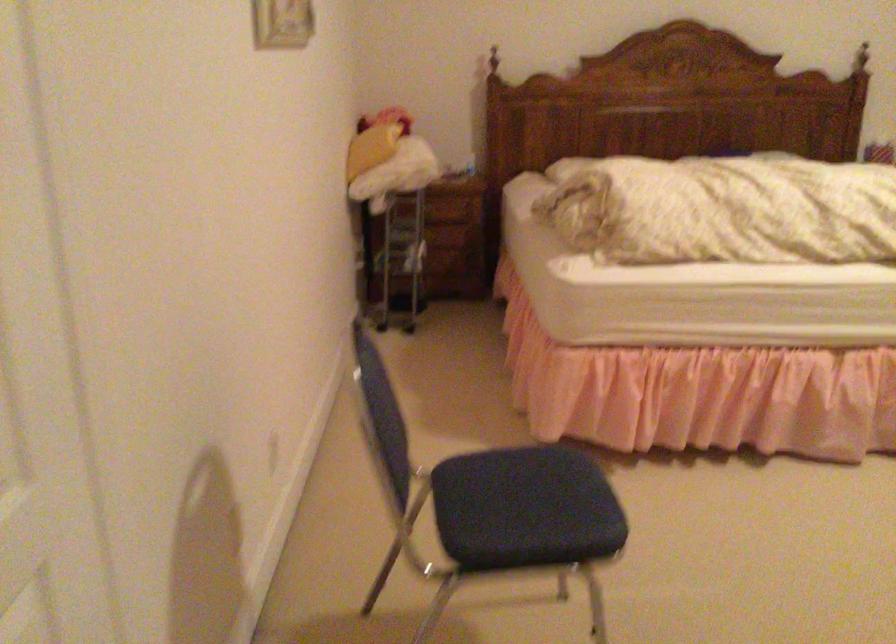
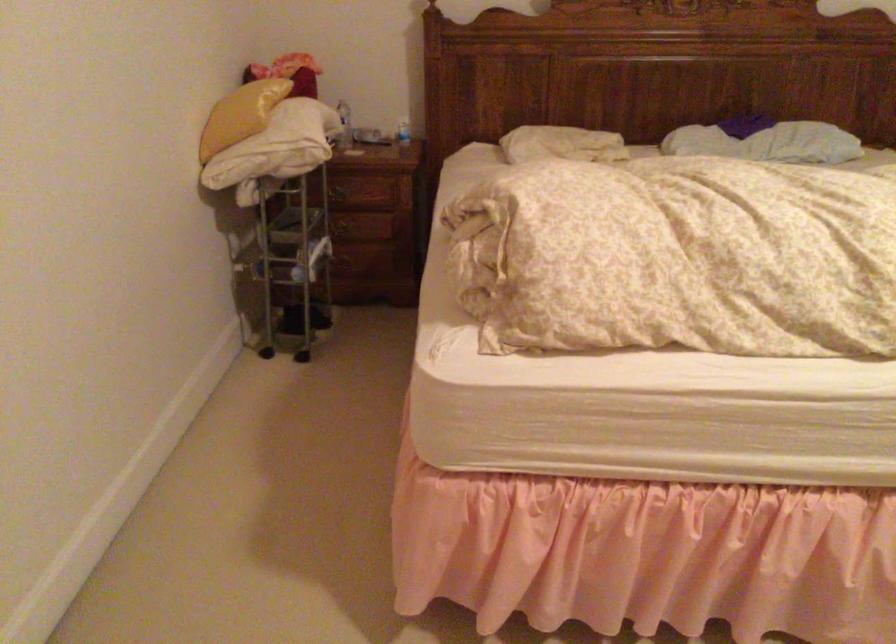
In the second image, find the point that corresponds to point 416,205 in the first image.

(338, 194)